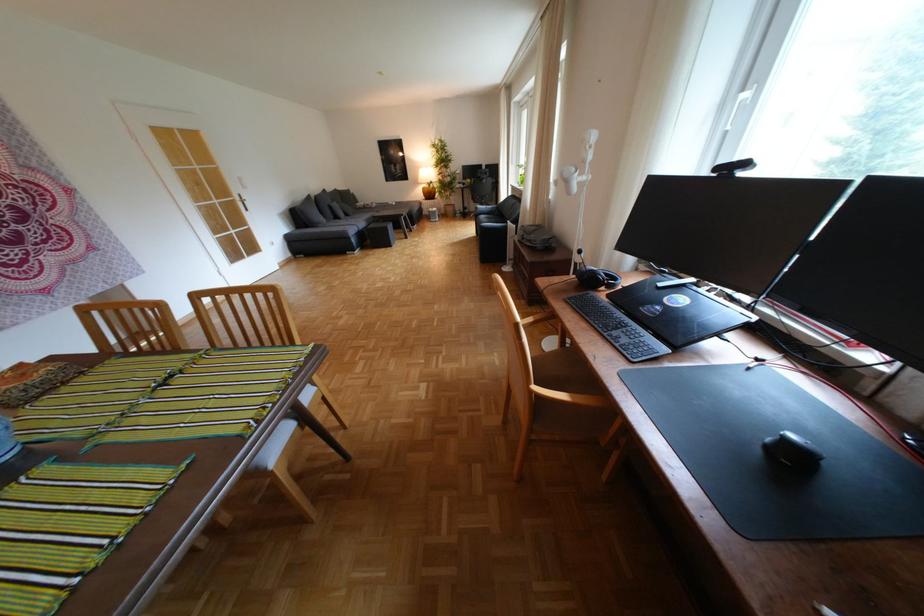
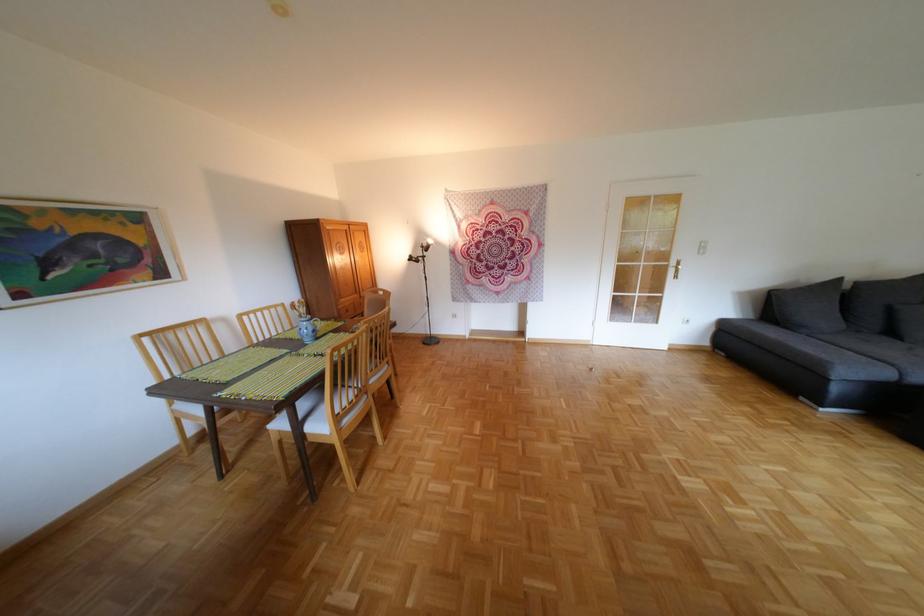
The point at (310, 217) is marked in the first image. Where is the corresponding point in the second image?

(787, 304)